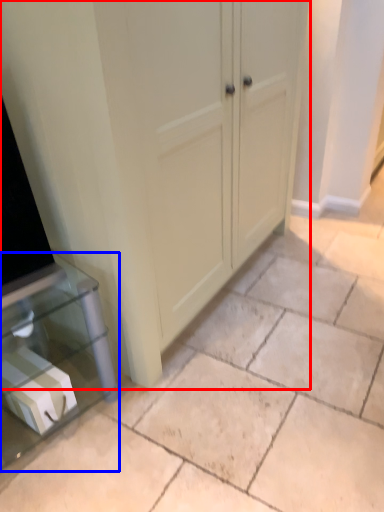
Question: Which object appears farthest to the camera in this image, cupboard (highlighted by a red box) or furniture (highlighted by a blue box)?

Choices:
 (A) cupboard
 (B) furniture

Answer: (B)